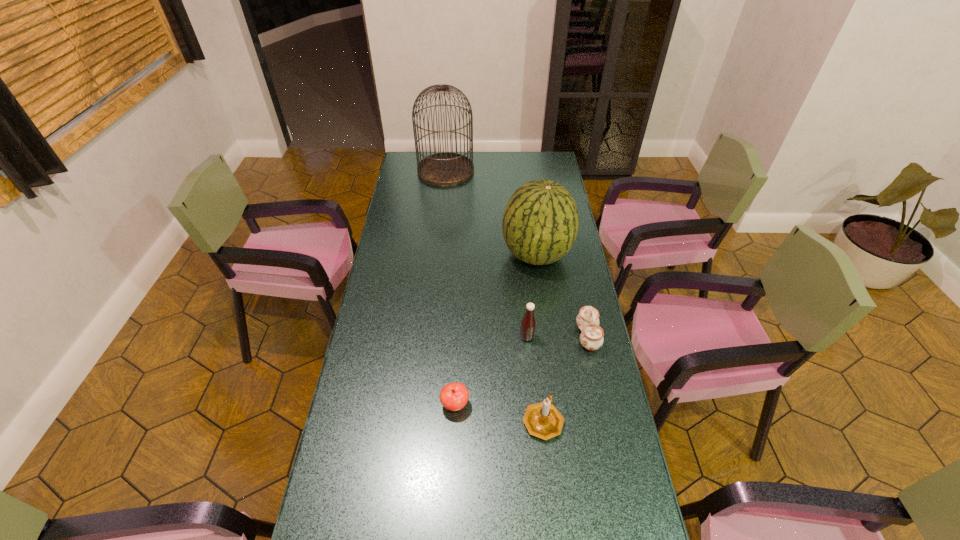
What are the coordinates of `the tallest object` in the screenshot? It's located at pyautogui.click(x=442, y=169).

What are the coordinates of `the farthest object` in the screenshot? It's located at (442, 169).

The image size is (960, 540). What are the coordinates of `the fifth shortest object` in the screenshot? It's located at (540, 223).

In order to click on watermelon in this screenshot , I will do `click(540, 223)`.

Where is `Tabasco sauce`? Tabasco sauce is located at coordinates (528, 323).

Locate an element on the screen. The image size is (960, 540). the third shortest object is located at coordinates (543, 420).

Where is `the fifth tallest object`? The image size is (960, 540). the fifth tallest object is located at coordinates (591, 337).

Locate an element on the screen. the shortest object is located at coordinates (454, 396).

This screenshot has height=540, width=960. I want to click on vacant space located on the back of the birdcage, so click(x=447, y=151).

The width and height of the screenshot is (960, 540). I want to click on blank space located on the back of the second tallest object, so click(x=529, y=203).